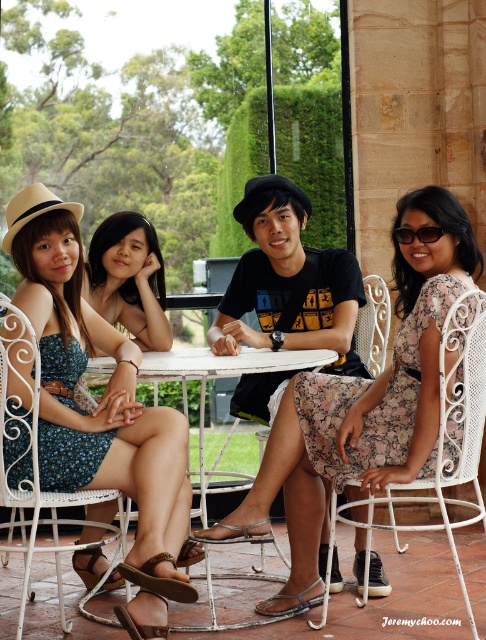
You are planning to host a picnic and need to determine if the blue floral dress at center can be folded and stored under the white metal table at center. Based on their sizes, is this feasible?

The blue floral dress at center is larger in size compared to the white metal table at center, so it may not fit under the table when folded, as the dress is bigger.

You are a photographer setting up a shoot at the scene described. You need to position a light source so that it illuminates the blue floral dress at center without casting a shadow on the white metal table at center. Is this possible given their positions?

The blue floral dress at center is above the white metal table at center, so positioning the light source directly above the dress would illuminate it while avoiding casting a shadow on the table below.